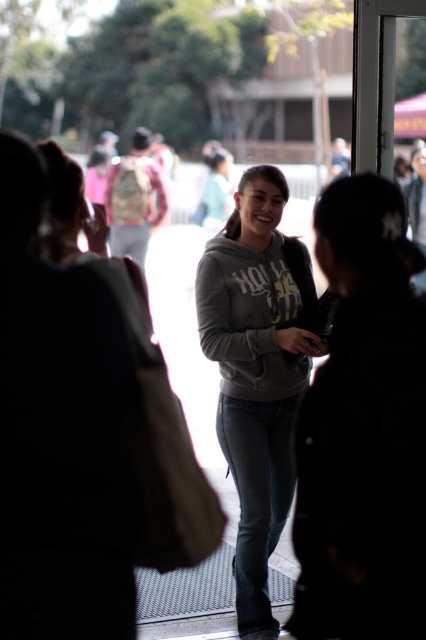
You are a tailor measuring the distance between two garments displayed on a mannequin. The garments are the gray matte hoodie at center and the gray fleece sweatshirt at center. The mannequin is placed in a store window. If the store requires at least 4 inches of space between displayed items for safety, is the current distance sufficient?

The distance between the gray matte hoodie at center and the gray fleece sweatshirt at center is 3.20 inches. Since 3.20 inches is less than the required 4 inches, the current distance is insufficient to meet the store safety requirement.

You are a fashion designer analyzing the clothing items in the scene. Which clothing item, the gray matte hoodie at center or the gray fleece sweatshirt at center, has a taller silhouette?

The gray matte hoodie at center is taller than the gray fleece sweatshirt at center.

You are a photographer trying to capture a clear image of both the gray matte hoodie at center and the gray fleece sweatshirt at center. Based on their positions, which one is closer to the camera?

The gray matte hoodie at center is closer to the camera because it is in front of the gray fleece sweatshirt at center.